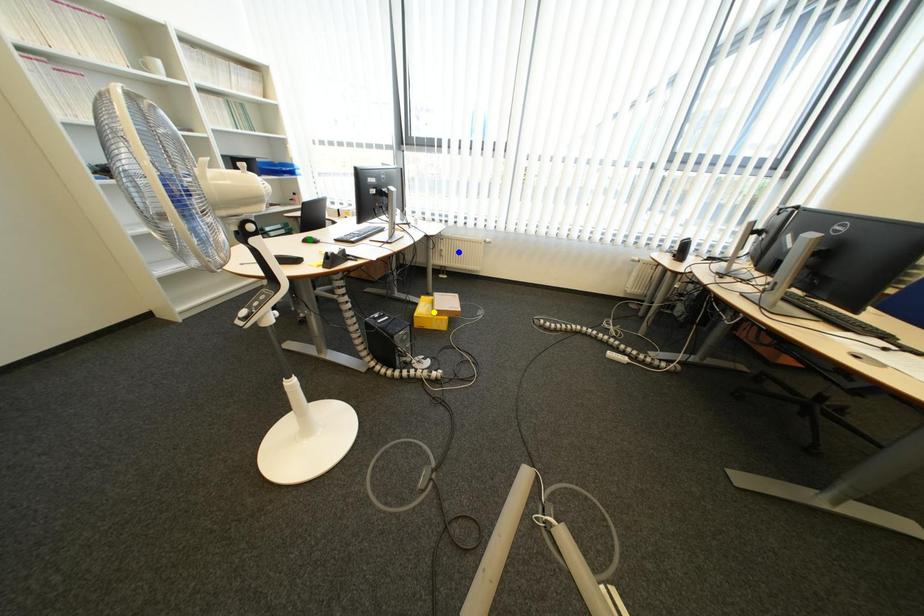
Order these from nearest to farthest:
A) blue point
B) yellow point
C) green point

green point, yellow point, blue point